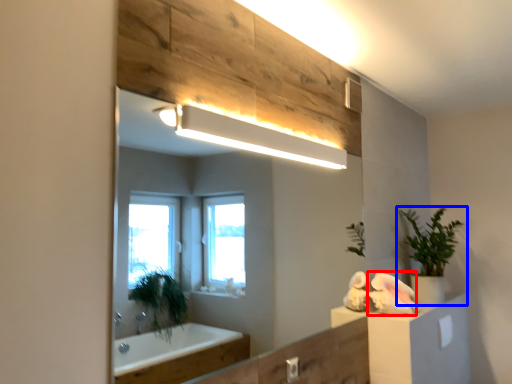
Question: Which of the following is the farthest to the observer, animal (highlighted by a red box) or houseplant (highlighted by a blue box)?

Choices:
 (A) animal
 (B) houseplant

Answer: (B)